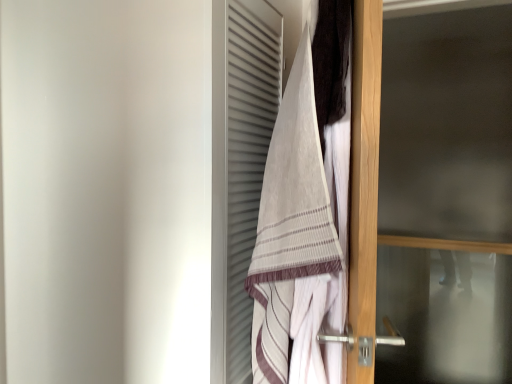
Question: Considering the relative sizes of striped cotton towel at center and transparent glass screen door at right in the image provided, is striped cotton towel at center wider than transparent glass screen door at right?

Choices:
 (A) yes
 (B) no

Answer: (A)

Question: Does striped cotton towel at center have a lesser width compared to transparent glass screen door at right?

Choices:
 (A) yes
 (B) no

Answer: (B)

Question: Is striped cotton towel at center to the left of transparent glass screen door at right from the viewer's perspective?

Choices:
 (A) yes
 (B) no

Answer: (A)

Question: Is striped cotton towel at center facing away from transparent glass screen door at right?

Choices:
 (A) yes
 (B) no

Answer: (B)

Question: From a real-world perspective, is striped cotton towel at center under transparent glass screen door at right?

Choices:
 (A) yes
 (B) no

Answer: (A)

Question: Can you confirm if striped cotton towel at center is bigger than transparent glass screen door at right?

Choices:
 (A) yes
 (B) no

Answer: (B)

Question: Does dark brown towel at upper right have a larger size compared to transparent glass screen door at right?

Choices:
 (A) yes
 (B) no

Answer: (B)

Question: Is dark brown towel at upper right with transparent glass screen door at right?

Choices:
 (A) yes
 (B) no

Answer: (B)

Question: Is dark brown towel at upper right facing towards transparent glass screen door at right?

Choices:
 (A) no
 (B) yes

Answer: (A)

Question: Is dark brown towel at upper right positioned before transparent glass screen door at right?

Choices:
 (A) no
 (B) yes

Answer: (B)

Question: Is dark brown towel at upper right at the right side of transparent glass screen door at right?

Choices:
 (A) no
 (B) yes

Answer: (A)

Question: Can we say dark brown towel at upper right lies outside transparent glass screen door at right?

Choices:
 (A) yes
 (B) no

Answer: (A)

Question: Is dark brown towel at upper right further to the viewer compared to striped cotton towel at center?

Choices:
 (A) no
 (B) yes

Answer: (A)